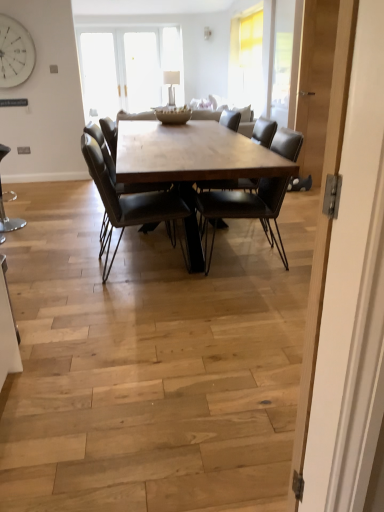
Question: Which direction should I rotate to look at leather chair at center, marked as the second chair in a right-to-left arrangement?

Choices:
 (A) right
 (B) left

Answer: (B)

Question: Is white matte clock at upper left bigger than leather chair at center, marked as the second chair in a right-to-left arrangement?

Choices:
 (A) no
 (B) yes

Answer: (A)

Question: Can you confirm if white matte clock at upper left is positioned to the right of leather chair at center, marked as the second chair in a right-to-left arrangement?

Choices:
 (A) yes
 (B) no

Answer: (B)

Question: Is leather chair at center, which is the 2th chair from left to right, surrounded by white matte clock at upper left?

Choices:
 (A) no
 (B) yes

Answer: (A)

Question: From the image's perspective, would you say white matte clock at upper left is positioned over leather chair at center, marked as the second chair in a right-to-left arrangement?

Choices:
 (A) yes
 (B) no

Answer: (A)

Question: Considering the relative sizes of white matte clock at upper left and leather chair at center, which is the 2th chair from left to right, in the image provided, is white matte clock at upper left taller than leather chair at center, which is the 2th chair from left to right,?

Choices:
 (A) no
 (B) yes

Answer: (A)

Question: Can you confirm if white matte clock at upper left is thinner than leather chair at center, which is the 2th chair from left to right?

Choices:
 (A) no
 (B) yes

Answer: (B)

Question: Would you say leather chair at center, which is the 2th chair from left to right, is outside metallic stool at lower left, which ranks as the third chair in right-to-left order?

Choices:
 (A) no
 (B) yes

Answer: (B)

Question: Considering the relative sizes of leather chair at center, marked as the second chair in a right-to-left arrangement, and metallic stool at lower left, the 1th chair from the left, in the image provided, is leather chair at center, marked as the second chair in a right-to-left arrangement, shorter than metallic stool at lower left, the 1th chair from the left,?

Choices:
 (A) no
 (B) yes

Answer: (A)

Question: From a real-world perspective, does leather chair at center, marked as the second chair in a right-to-left arrangement, sit lower than metallic stool at lower left, which ranks as the third chair in right-to-left order?

Choices:
 (A) no
 (B) yes

Answer: (A)

Question: Can metallic stool at lower left, the 1th chair from the left, be found inside leather chair at center, which is the 2th chair from left to right?

Choices:
 (A) no
 (B) yes

Answer: (A)

Question: Could you tell me if leather chair at center, which is the 2th chair from left to right, is turned towards metallic stool at lower left, the 1th chair from the left?

Choices:
 (A) no
 (B) yes

Answer: (A)

Question: Can you confirm if leather chair at center, marked as the second chair in a right-to-left arrangement, is smaller than metallic stool at lower left, which ranks as the third chair in right-to-left order?

Choices:
 (A) yes
 (B) no

Answer: (B)

Question: Can you confirm if matte black chair at center, the first chair positioned from the right, is thinner than leather chair at center, marked as the second chair in a right-to-left arrangement?

Choices:
 (A) yes
 (B) no

Answer: (B)